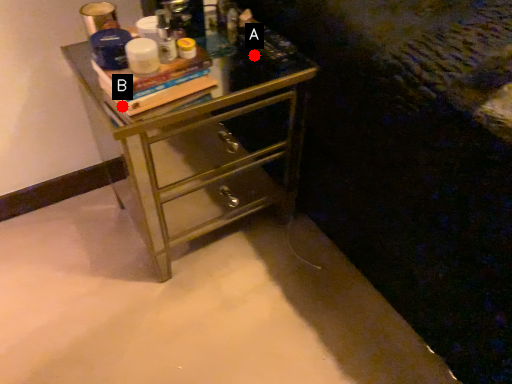
Question: Two points are circled on the image, labeled by A and B beside each circle. Which point appears farthest from the camera in this image?

Choices:
 (A) A is further
 (B) B is further

Answer: (A)